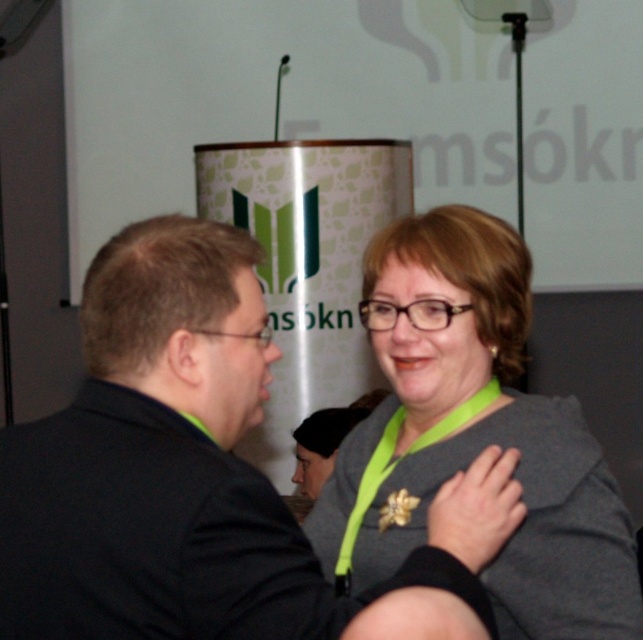
Who is taller, black matte suit at center or gray matte jacket at center?

gray matte jacket at center is taller.

The height and width of the screenshot is (640, 643). I want to click on black matte suit at center, so click(x=201, y=476).